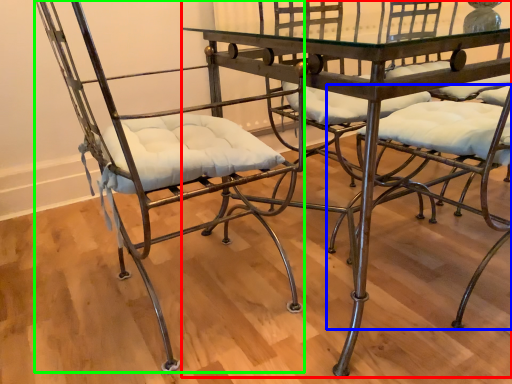
Question: Which object is the farthest from table (highlighted by a red box)? Choose among these: chair (highlighted by a blue box) or chair (highlighted by a green box).

Choices:
 (A) chair
 (B) chair

Answer: (B)